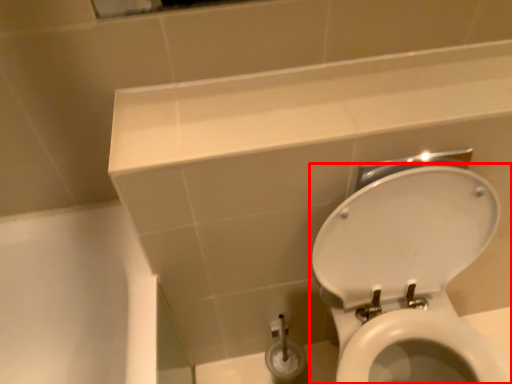
Question: In this image, where is toilet (annotated by the red box) located relative to ledge?

Choices:
 (A) left
 (B) right

Answer: (B)